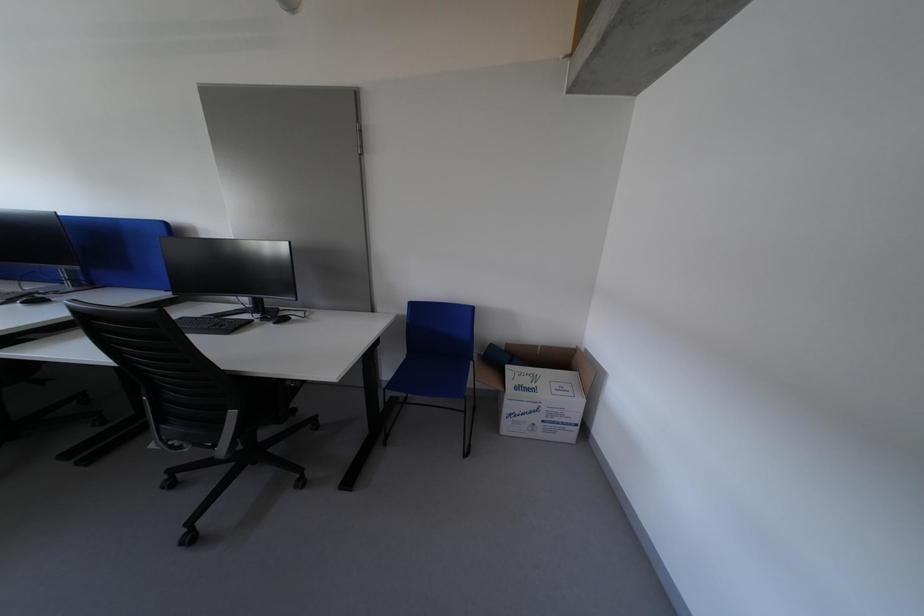
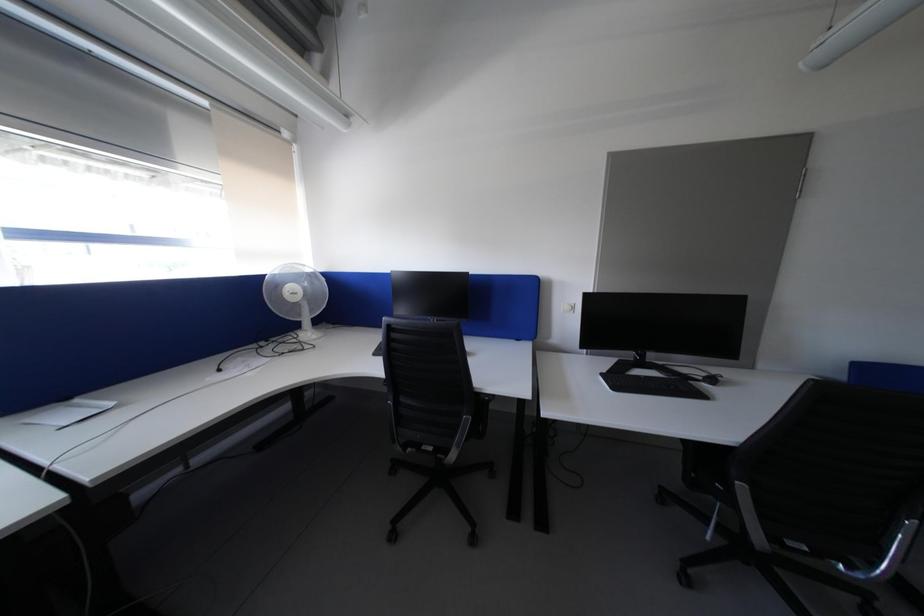
Question: Which direction would the cameraman need to move to produce the second image? Reply with the corresponding letter.

Choices:
 (A) Left
 (B) Right
 (C) Forward
 (D) Backward

Answer: (A)